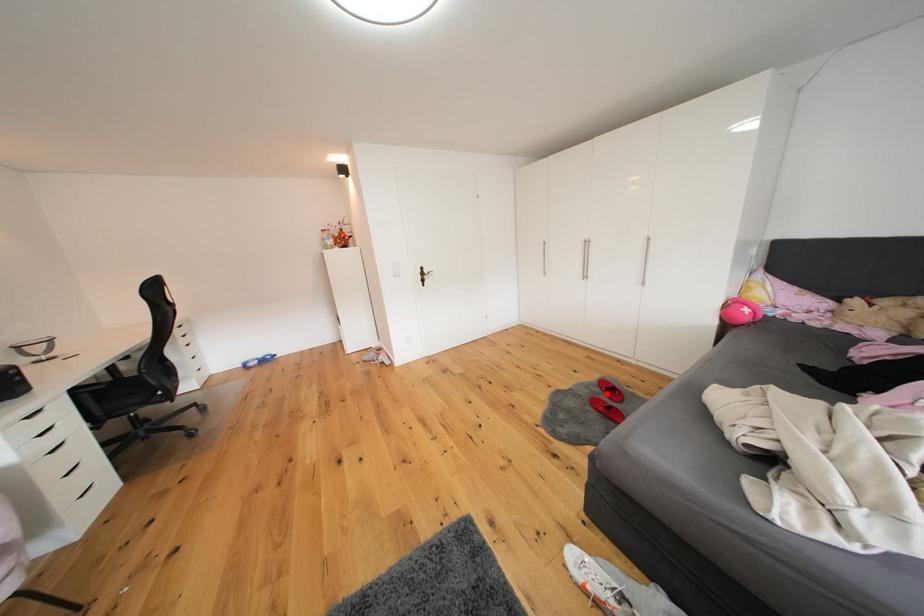
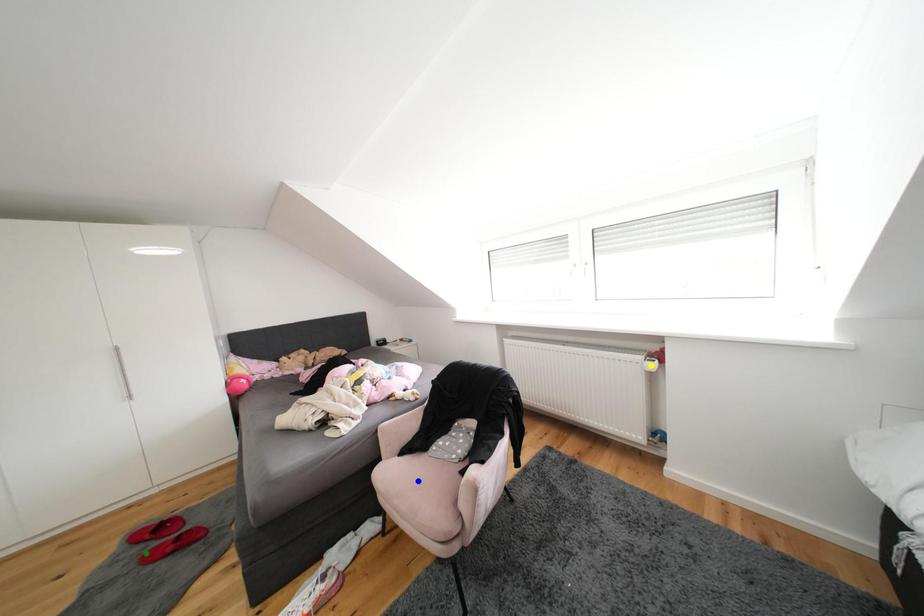
Question: I am providing you with two images of the same scene from different viewpoints. A red point is marked on the first image. You are given multiple points on the second image. In image 2, which mark is for the same physical point as the one in image 1?

Choices:
 (A) green point
 (B) yellow point
 (C) blue point

Answer: (A)